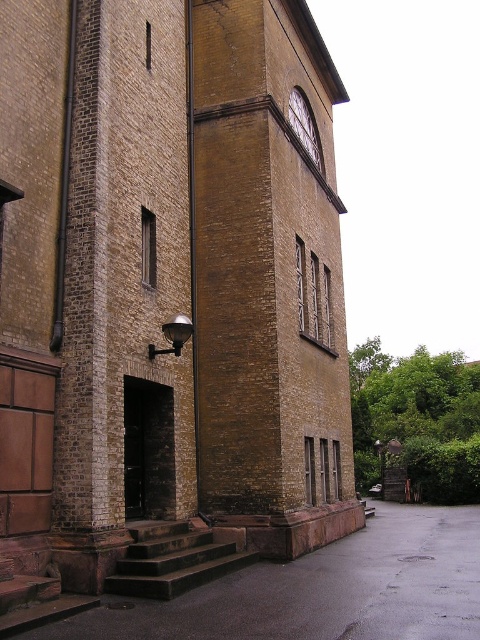
Question: Considering the relative positions of brown brick clock tower at center and matte brown clock at upper center in the image provided, where is brown brick clock tower at center located with respect to matte brown clock at upper center?

Choices:
 (A) above
 (B) below

Answer: (B)

Question: Which of the following is the farthest from the observer?

Choices:
 (A) brown brick clock tower at center
 (B) matte brown clock at upper center

Answer: (B)

Question: Can you confirm if brown brick clock tower at center is positioned to the left of matte brown clock at upper center?

Choices:
 (A) yes
 (B) no

Answer: (A)

Question: Which point is closer to the camera?

Choices:
 (A) brown brick clock tower at center
 (B) matte brown clock at upper center

Answer: (A)

Question: Considering the relative positions of brown brick clock tower at center and matte brown clock at upper center in the image provided, where is brown brick clock tower at center located with respect to matte brown clock at upper center?

Choices:
 (A) right
 (B) left

Answer: (B)